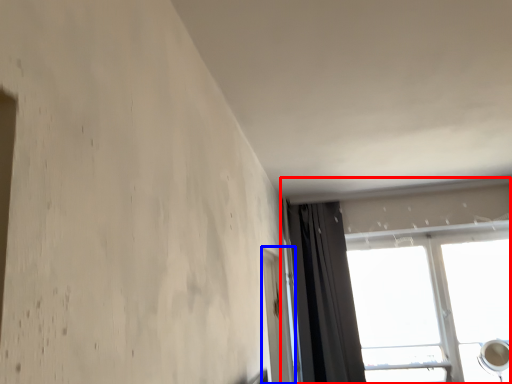
Question: Which point is further to the camera, window (highlighted by a red box) or screen door (highlighted by a blue box)?

Choices:
 (A) window
 (B) screen door

Answer: (A)